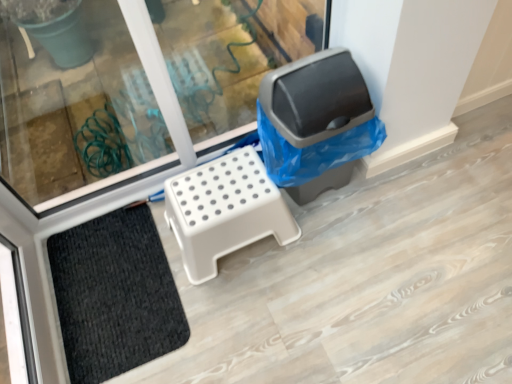
Where is `gray plastic recycling bin at right`? The image size is (512, 384). gray plastic recycling bin at right is located at coordinates (316, 120).

The image size is (512, 384). Find the location of `white plastic step stool at center`. white plastic step stool at center is located at coordinates (224, 211).

Measure the distance between point [208,267] and camera.

They are 1.45 meters apart.

Identify the location of black textured mat at lower left. This screenshot has width=512, height=384. (115, 295).

You are a GUI agent. You are given a task and a screenshot of the screen. Output one action in this format:
    pyautogui.click(x=<x>, y=<y>)
    Task: Click on the gray plastic recycling bin at right
    This screenshot has height=384, width=512.
    Given the screenshot: What is the action you would take?
    pyautogui.click(x=316, y=120)

In the image, is gray plastic recycling bin at right on the left side or the right side of black textured mat at lower left?

gray plastic recycling bin at right is to the right of black textured mat at lower left.

Is gray plastic recycling bin at right not within black textured mat at lower left?

Absolutely, gray plastic recycling bin at right is external to black textured mat at lower left.

Considering the relative sizes of gray plastic recycling bin at right and black textured mat at lower left in the image provided, is gray plastic recycling bin at right wider than black textured mat at lower left?

No, gray plastic recycling bin at right is not wider than black textured mat at lower left.

Is point (366, 119) more distant than point (143, 310)?

No, it is in front of (143, 310).

In the image, is black textured mat at lower left positioned in front of or behind gray plastic recycling bin at right?

Visually, black textured mat at lower left is located behind gray plastic recycling bin at right.

Where is `recycling bin above the black textured mat at lower left (from the image's perspective)`? Image resolution: width=512 pixels, height=384 pixels. recycling bin above the black textured mat at lower left (from the image's perspective) is located at coordinates (x=316, y=120).

Is black textured mat at lower left surrounding gray plastic recycling bin at right?

Definitely not — gray plastic recycling bin at right is not inside black textured mat at lower left.

Who is taller, black textured mat at lower left or gray plastic recycling bin at right?

gray plastic recycling bin at right is taller.

Identify the location of recycling bin in front of the white plastic step stool at center. The height and width of the screenshot is (384, 512). (316, 120).

Does white plastic step stool at center have a lesser width compared to gray plastic recycling bin at right?

No.

Based on the photo, are white plastic step stool at center and gray plastic recycling bin at right located far from each other?

Actually, white plastic step stool at center and gray plastic recycling bin at right are a little close together.

From a real-world perspective, is white plastic step stool at center located higher than gray plastic recycling bin at right?

Actually, white plastic step stool at center is physically below gray plastic recycling bin at right in the real world.

Between black textured mat at lower left and white plastic step stool at center, which one is positioned in front?

white plastic step stool at center is closer to the camera.

Locate an element on the screen. The width and height of the screenshot is (512, 384). furniture in front of the black textured mat at lower left is located at coordinates (224, 211).

Is black textured mat at lower left directly adjacent to white plastic step stool at center?

No, black textured mat at lower left is not making contact with white plastic step stool at center.

Is white plastic step stool at center far away from black textured mat at lower left?

They are positioned close to each other.

Considering the relative sizes of white plastic step stool at center and black textured mat at lower left in the image provided, is white plastic step stool at center taller than black textured mat at lower left?

Correct, white plastic step stool at center is much taller as black textured mat at lower left.

Is white plastic step stool at center turned away from black textured mat at lower left?

No, black textured mat at lower left is not at the back of white plastic step stool at center.

Is white plastic step stool at center positioned before black textured mat at lower left?

Yes, white plastic step stool at center is closer to the camera.

Does gray plastic recycling bin at right have a greater width compared to white plastic step stool at center?

No.

Considering the sizes of gray plastic recycling bin at right and white plastic step stool at center in the image, is gray plastic recycling bin at right bigger or smaller than white plastic step stool at center?

In the image, gray plastic recycling bin at right appears to be larger than white plastic step stool at center.

Can you tell me how much gray plastic recycling bin at right and white plastic step stool at center differ in facing direction?

There is a 0.000619-degree angle between the facing directions of gray plastic recycling bin at right and white plastic step stool at center.

Find the location of a particular element. This screenshot has width=512, height=384. doormat below the gray plastic recycling bin at right (from a real-world perspective) is located at coordinates (115, 295).

You are a GUI agent. You are given a task and a screenshot of the screen. Output one action in this format:
    pyautogui.click(x=<x>, y=<y>)
    Task: Click on the doormat lying on the left of gray plastic recycling bin at right
    
    Given the screenshot: What is the action you would take?
    pyautogui.click(x=115, y=295)

Estimate the real-world distances between objects in this image. Which object is closer to black textured mat at lower left, white plastic step stool at center or gray plastic recycling bin at right?

white plastic step stool at center lies closer to black textured mat at lower left than the other object.

From the image, which object appears to be farther from gray plastic recycling bin at right, black textured mat at lower left or white plastic step stool at center?

Based on the image, black textured mat at lower left appears to be further to gray plastic recycling bin at right.

Based on their spatial positions, is gray plastic recycling bin at right or white plastic step stool at center closer to black textured mat at lower left?

Based on the image, white plastic step stool at center appears to be nearer to black textured mat at lower left.

Considering their positions, is gray plastic recycling bin at right positioned further to white plastic step stool at center than black textured mat at lower left?

The object further to white plastic step stool at center is black textured mat at lower left.

Estimate the real-world distances between objects in this image. Which object is closer to white plastic step stool at center, black textured mat at lower left or gray plastic recycling bin at right?

The object closer to white plastic step stool at center is gray plastic recycling bin at right.

Considering their positions, is white plastic step stool at center positioned further to gray plastic recycling bin at right than black textured mat at lower left?

The object further to gray plastic recycling bin at right is black textured mat at lower left.

The image size is (512, 384). I want to click on furniture between black textured mat at lower left and gray plastic recycling bin at right in the horizontal direction, so click(224, 211).